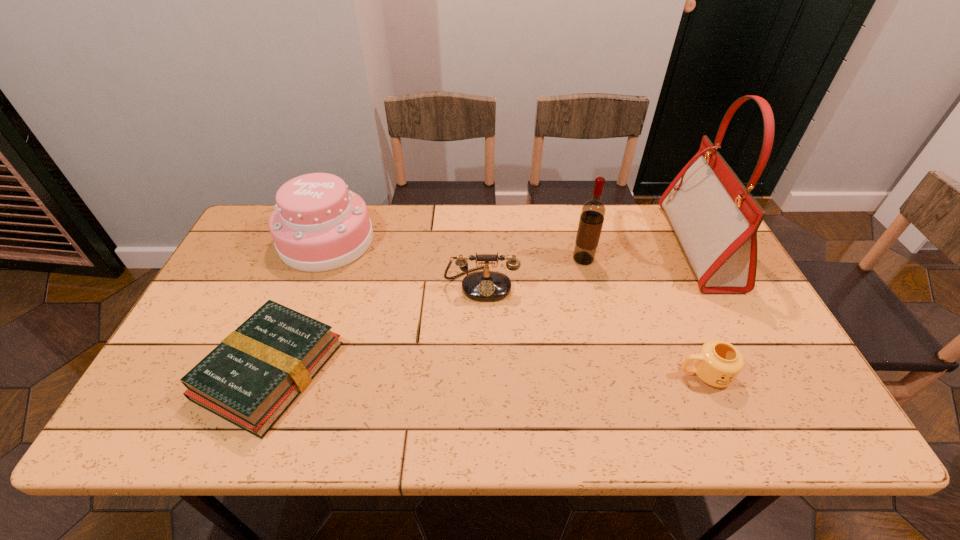
At what (x,y) coordinates should I click in order to perform the action: click on the tallest object. Please return your answer as a coordinate pair (x, y). Looking at the image, I should click on (715, 218).

Identify the location of the rightmost object. (715, 218).

At what (x,y) coordinates should I click in order to perform the action: click on wine bottle. Please return your answer as a coordinate pair (x, y). Looking at the image, I should click on (593, 211).

Where is `the second tallest object`? the second tallest object is located at coordinates (593, 211).

Identify the location of the fourth shortest object. (318, 225).

Image resolution: width=960 pixels, height=540 pixels. I want to click on the fourth object from right to left, so click(x=486, y=285).

At what (x,y) coordinates should I click in order to perform the action: click on telephone. Please return your answer as a coordinate pair (x, y). This screenshot has width=960, height=540. Looking at the image, I should click on (486, 285).

Locate an element on the screen. This screenshot has width=960, height=540. mug is located at coordinates (718, 363).

You are a GUI agent. You are given a task and a screenshot of the screen. Output one action in this format:
    pyautogui.click(x=<x>, y=<y>)
    Task: Click on the fifth tallest object
    
    Given the screenshot: What is the action you would take?
    pyautogui.click(x=718, y=363)

I want to click on the shortest object, so click(x=250, y=379).